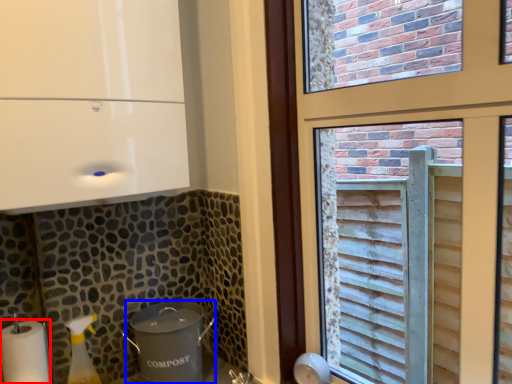
Question: Which object is closer to the camera taking this photo, paper towel (highlighted by a red box) or appliance (highlighted by a blue box)?

Choices:
 (A) paper towel
 (B) appliance

Answer: (A)